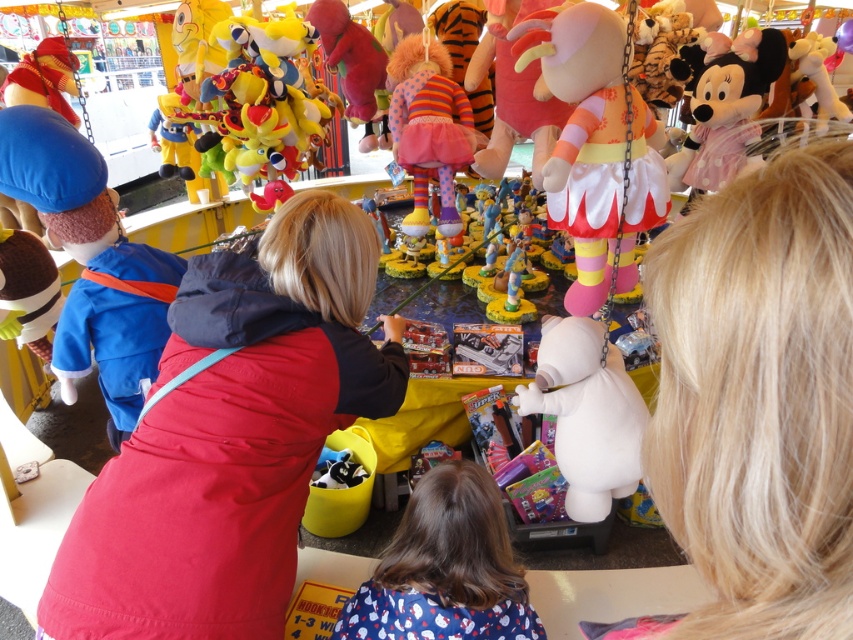
Question: Which of the following is the closest to the observer?

Choices:
 (A) (643, 120)
 (B) (595, 362)
 (C) (804, 193)
 (D) (759, 100)

Answer: (C)

Question: Which of these objects is positioned farthest from the striped fabric clown at center?

Choices:
 (A) blonde hair at upper right
 (B) pink fabric minnie mouse plush at upper right

Answer: (A)

Question: Observing the image, what is the correct spatial positioning of velvet blue coat at left in reference to white plush bear at center?

Choices:
 (A) below
 (B) above

Answer: (B)

Question: Does blonde hair at upper right appear on the left side of white plush bear at center?

Choices:
 (A) yes
 (B) no

Answer: (A)

Question: Does matte pink plush at upper right appear on the right side of pink fabric minnie mouse plush at upper right?

Choices:
 (A) no
 (B) yes

Answer: (A)

Question: Which point appears closest to the camera in this image?

Choices:
 (A) (434, 92)
 (B) (714, 176)
 (C) (692, 464)

Answer: (C)